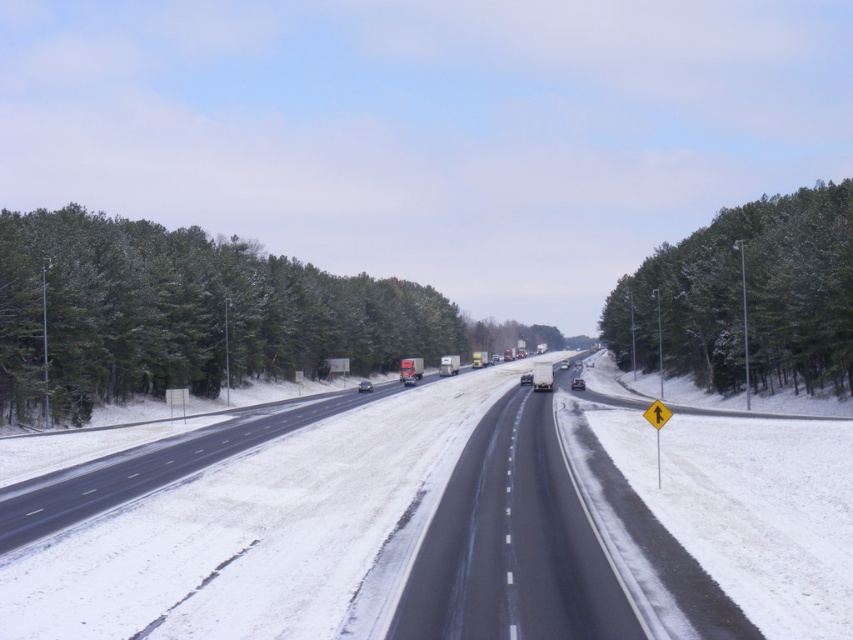
Question: Which object is farther from the camera taking this photo?

Choices:
 (A) black asphalt highway at center
 (B) green textured trees at right
 (C) green textured trees at left

Answer: (C)

Question: Is green textured trees at left smaller than green textured trees at right?

Choices:
 (A) no
 (B) yes

Answer: (B)

Question: Which object is the farthest from the green textured trees at right?

Choices:
 (A) black asphalt highway at center
 (B) green textured trees at left

Answer: (B)

Question: Does green textured trees at left appear under green textured trees at right?

Choices:
 (A) no
 (B) yes

Answer: (B)

Question: Which of these objects is positioned farthest from the green textured trees at right?

Choices:
 (A) black asphalt highway at center
 (B) green textured trees at left

Answer: (B)

Question: Can you confirm if green textured trees at right is thinner than black asphalt highway at center?

Choices:
 (A) no
 (B) yes

Answer: (A)